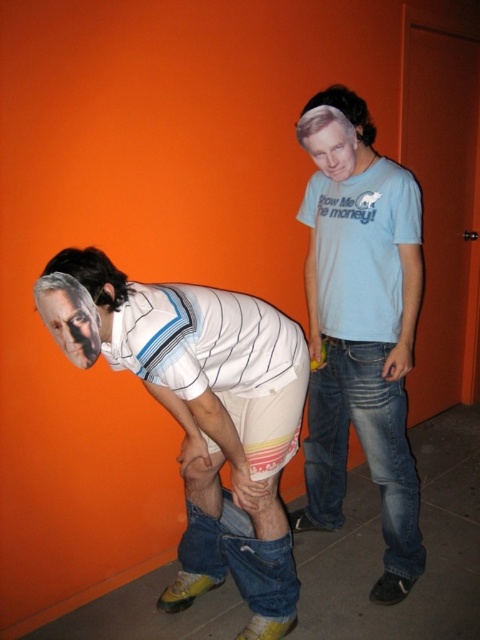
Question: From the image, what is the correct spatial relationship of white striped shirt at lower left in relation to smooth plastic face at lower left?

Choices:
 (A) below
 (B) above

Answer: (A)

Question: Which of the following is the farthest from the observer?

Choices:
 (A) (75, 355)
 (B) (325, 180)

Answer: (B)

Question: Does white striped shirt at lower left appear on the right side of smooth plastic face at lower left?

Choices:
 (A) no
 (B) yes

Answer: (B)

Question: Which point is farther to the camera?

Choices:
 (A) (316, 120)
 (B) (325, 92)
 (C) (278, 596)
 (D) (60, 346)

Answer: (B)

Question: Based on their relative distances, which object is nearer to the smooth light blue t-shirt at upper right?

Choices:
 (A) light blue cotton t-shirt at upper right
 (B) white striped shirt at lower left

Answer: (A)

Question: Does light blue cotton t-shirt at upper right appear on the left side of smooth light blue t-shirt at upper right?

Choices:
 (A) yes
 (B) no

Answer: (B)